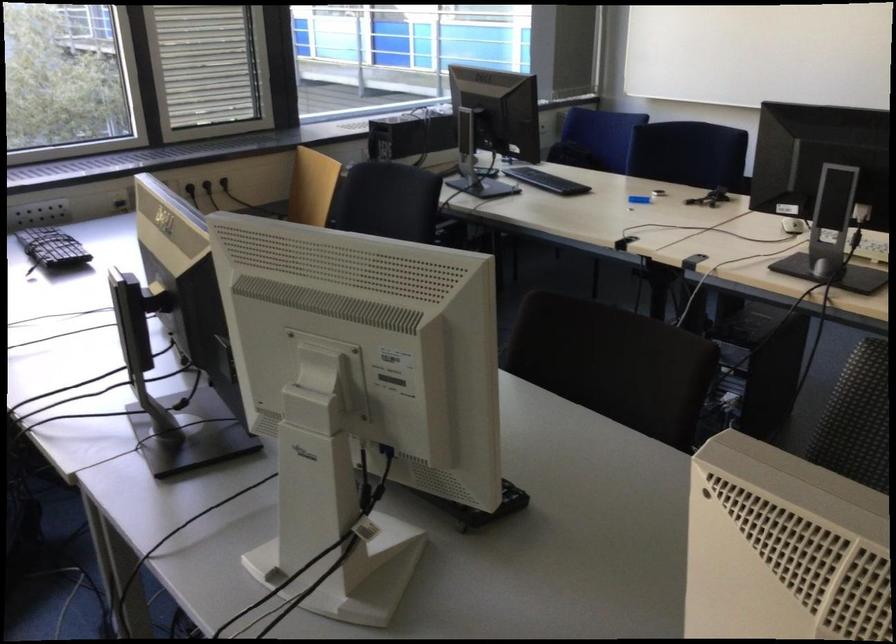
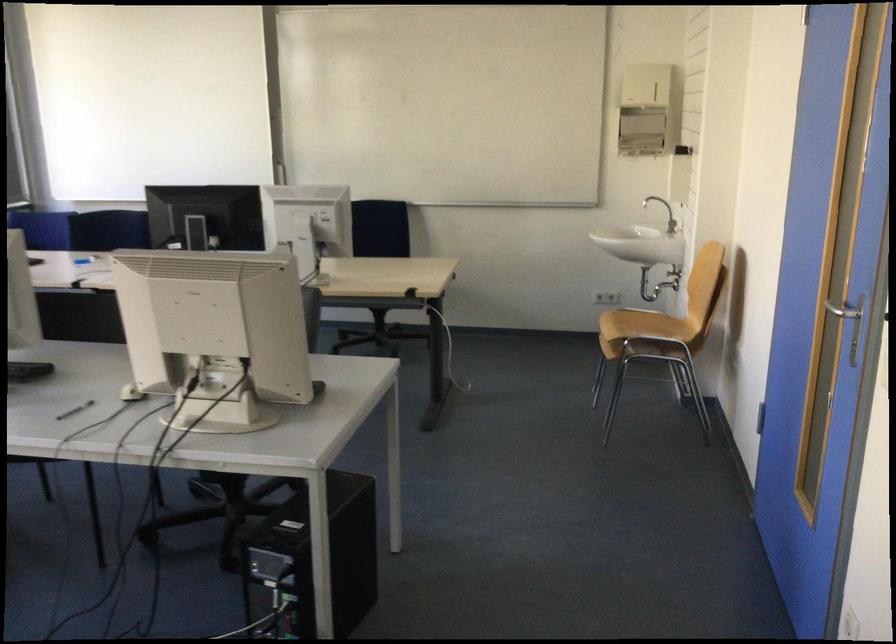
Question: I am providing you with two images of the same scene from different viewpoints. After the viewpoint changes to image2, which objects are now occluded?

Choices:
 (A) chair sitting surface
 (B) white drawer knob
 (C) sink faucet handle
 (D) patterned chair sitting surface

Answer: (D)